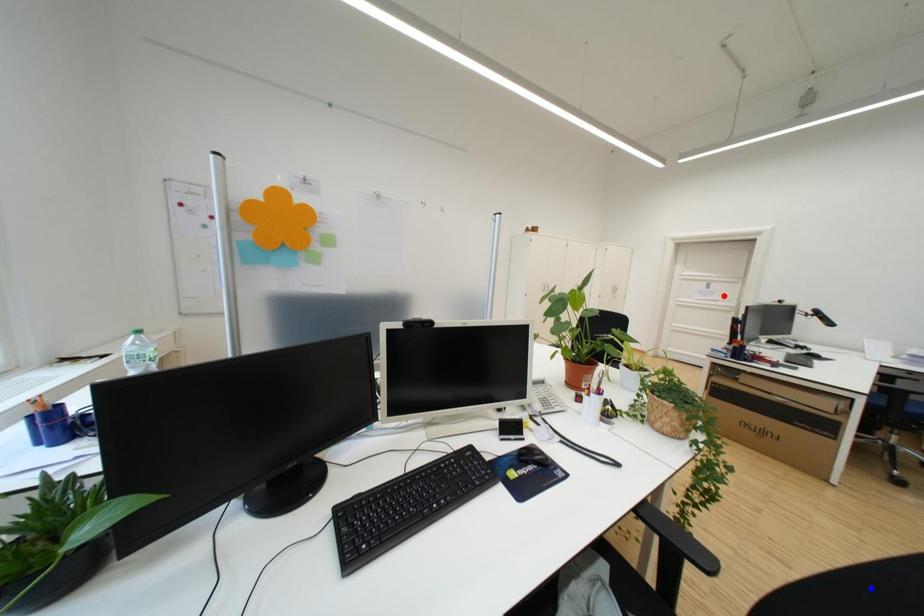
Question: Which of the two points in the image is closer to the camera?

Choices:
 (A) Blue point is closer.
 (B) Red point is closer.

Answer: (A)